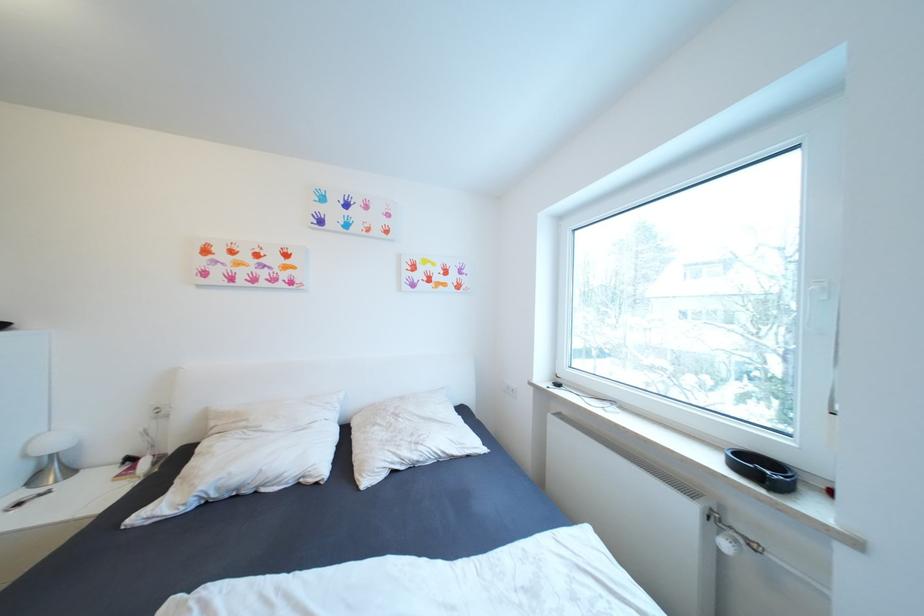
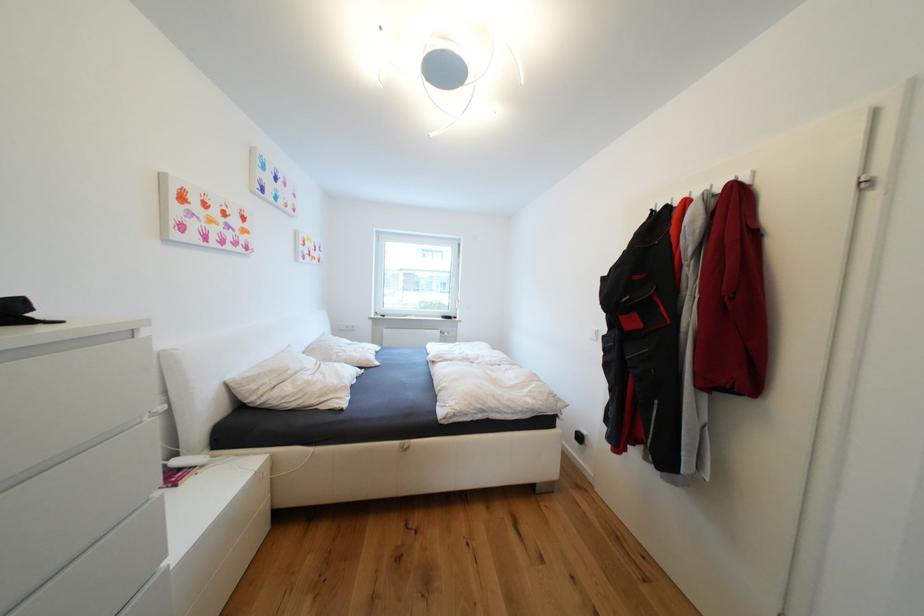
Question: I am providing you with two images of the same scene from different viewpoints. Which of the following objects are not visible in image2?

Choices:
 (A) metal coat hook
 (B) white drawer front
 (C) silver blender dial
 (D) black tray

Answer: (D)